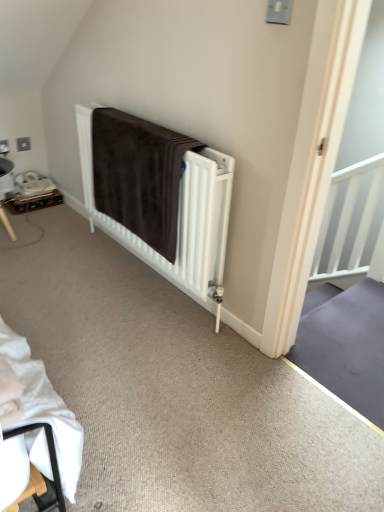
Question: Is wooden tray at left wider or thinner than brown plush blanket at center?

Choices:
 (A) thin
 (B) wide

Answer: (B)

Question: Does point (3, 204) appear closer or farther from the camera than point (175, 207)?

Choices:
 (A) closer
 (B) farther

Answer: (B)

Question: Estimate the real-world distances between objects in this image. Which object is closer to the brown plush blanket at center?

Choices:
 (A) wooden tray at left
 (B) brown fabric bed at center

Answer: (B)

Question: Estimate the real-world distances between objects in this image. Which object is farther from the brown plush blanket at center?

Choices:
 (A) wooden tray at left
 (B) brown fabric bed at center

Answer: (A)